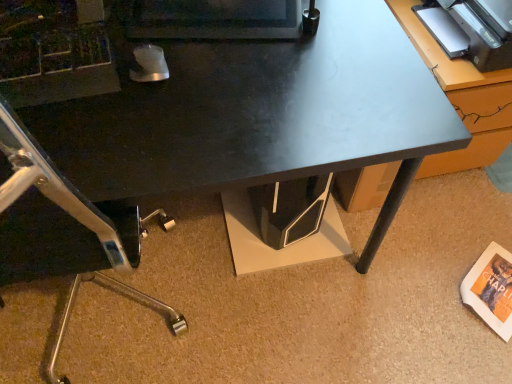
Question: From a real-world perspective, is matte black monitor at upper center positioned under metallic gray table at upper right based on gravity?

Choices:
 (A) yes
 (B) no

Answer: (B)

Question: Considering the relative sizes of matte black monitor at upper center and metallic gray table at upper right in the image provided, is matte black monitor at upper center wider than metallic gray table at upper right?

Choices:
 (A) no
 (B) yes

Answer: (A)

Question: Considering the relative sizes of matte black monitor at upper center and metallic gray table at upper right in the image provided, is matte black monitor at upper center shorter than metallic gray table at upper right?

Choices:
 (A) no
 (B) yes

Answer: (B)

Question: Is the position of matte black monitor at upper center less distant than that of metallic gray table at upper right?

Choices:
 (A) yes
 (B) no

Answer: (A)

Question: Is matte black monitor at upper center directly adjacent to metallic gray table at upper right?

Choices:
 (A) no
 (B) yes

Answer: (A)

Question: Is matte black monitor at upper center to the right of metallic gray table at upper right from the viewer's perspective?

Choices:
 (A) no
 (B) yes

Answer: (A)

Question: From the image's perspective, does black glossy desk at center appear higher than matte black monitor at upper center?

Choices:
 (A) no
 (B) yes

Answer: (A)

Question: Would you say black glossy desk at center contains matte black monitor at upper center?

Choices:
 (A) no
 (B) yes

Answer: (B)

Question: Is black glossy desk at center placed right next to matte black monitor at upper center?

Choices:
 (A) no
 (B) yes

Answer: (A)

Question: From a real-world perspective, is black glossy desk at center physically above matte black monitor at upper center?

Choices:
 (A) no
 (B) yes

Answer: (A)

Question: Is black glossy desk at center turned away from matte black monitor at upper center?

Choices:
 (A) yes
 (B) no

Answer: (B)

Question: Could you tell me if black glossy desk at center is turned towards matte black monitor at upper center?

Choices:
 (A) yes
 (B) no

Answer: (B)

Question: Does matte black monitor at upper center touch black glossy desk at center?

Choices:
 (A) no
 (B) yes

Answer: (A)